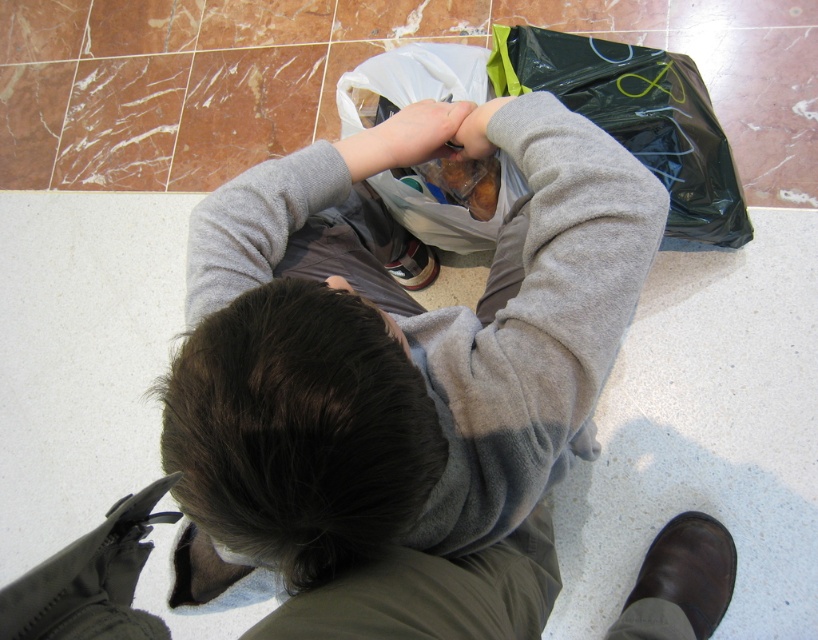
How distant is dark brown hair at center from black plastic bag at center?

A distance of 25.21 inches exists between dark brown hair at center and black plastic bag at center.

Who is more forward, (281, 440) or (412, 49)?

Point (281, 440) is more forward.

Image resolution: width=818 pixels, height=640 pixels. I want to click on dark brown hair at center, so click(x=299, y=429).

Locate an element on the screen. This screenshot has height=640, width=818. gray fleece sweatshirt at center is located at coordinates (393, 355).

Is gray fleece sweatshirt at center to the left of matte gray sweater at center from the viewer's perspective?

Indeed, gray fleece sweatshirt at center is positioned on the left side of matte gray sweater at center.

Which is in front, point (596, 150) or point (490, 141)?

Point (596, 150)

Locate an element on the screen. Image resolution: width=818 pixels, height=640 pixels. gray fleece sweatshirt at center is located at coordinates (393, 355).

Does gray fleece sweatshirt at center have a larger size compared to matte gray hand at center?

Yes, gray fleece sweatshirt at center is bigger than matte gray hand at center.

Is gray fleece sweatshirt at center above matte gray hand at center?

No.

Who is more distant from viewer, [232,308] or [420,104]?

The point [420,104] is behind.

The width and height of the screenshot is (818, 640). I want to click on gray fleece sweatshirt at center, so click(x=393, y=355).